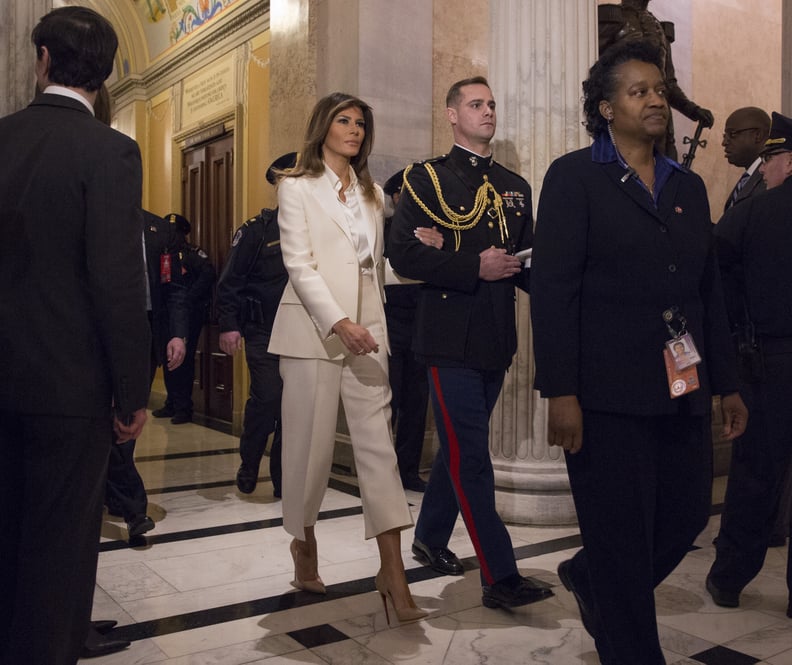
Identify the location of floor. The height and width of the screenshot is (665, 792). (269, 618).